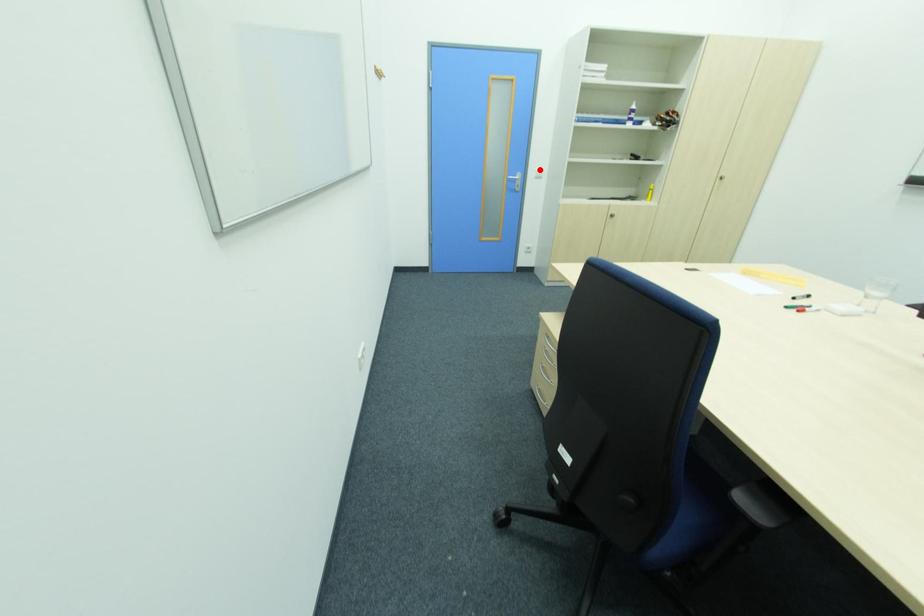
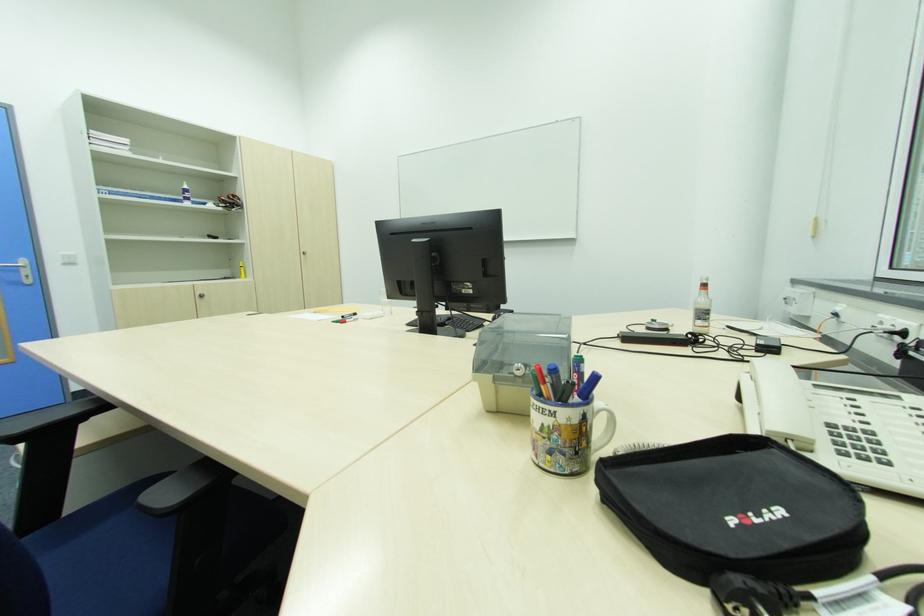
Question: I am providing you with two images of the same scene from different viewpoints. A red point is marked on the first image. Can you still see the location of the red point in image 2?

Choices:
 (A) Yes
 (B) No

Answer: (A)